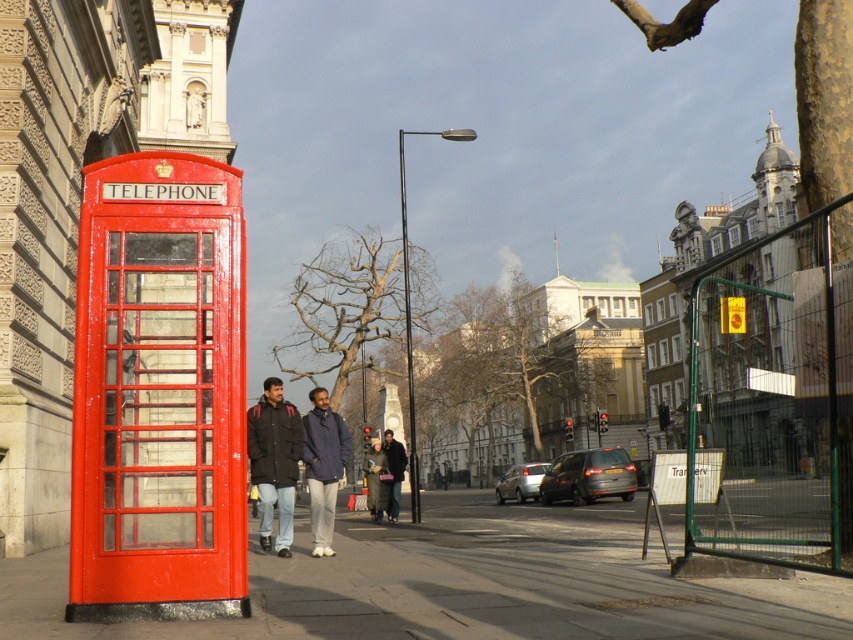
You are a delivery person who needs to place a large package on the ground near the blue fabric jacket at center. Given that the smooth concrete sidewalk at lower left is the only available surface, will the package fit on the sidewalk?

The smooth concrete sidewalk at lower left has a larger size compared to the blue fabric jacket at center, so yes, the package will fit on the sidewalk since it is larger than the jacket.

You are a fashion designer observing two individuals on a London street. You notice a dark brown leather jacket at center and a dark gray wool coat at center. Which clothing item is positioned higher on the person wearing it?

The dark brown leather jacket at center is located above the dark gray wool coat at center, so the dark brown leather jacket at center is positioned higher on the person wearing it.